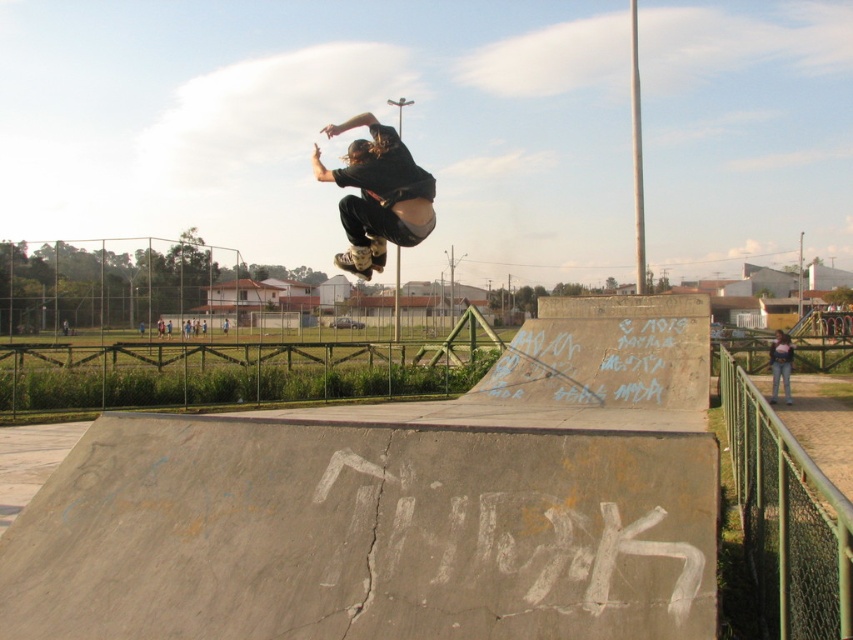
Question: Is green chain-link fence at lower right to the right of matte black skateboarder at center from the viewer's perspective?

Choices:
 (A) yes
 (B) no

Answer: (A)

Question: Is green chain-link fence at lower right below matte black skateboarder at center?

Choices:
 (A) yes
 (B) no

Answer: (A)

Question: Which point is closer to the camera taking this photo?

Choices:
 (A) (747, 490)
 (B) (775, 353)
 (C) (379, 268)
 (D) (379, 253)

Answer: (A)

Question: Which of the following is the farthest from the observer?

Choices:
 (A) (335, 266)
 (B) (801, 582)

Answer: (A)

Question: Estimate the real-world distances between objects in this image. Which object is closer to the matte black skateboard at center?

Choices:
 (A) green chain-link fence at lower right
 (B) matte black skateboarder at center
 (C) denim jacket at lower right

Answer: (A)

Question: Can you confirm if matte black skateboard at center is bigger than denim jacket at lower right?

Choices:
 (A) yes
 (B) no

Answer: (B)